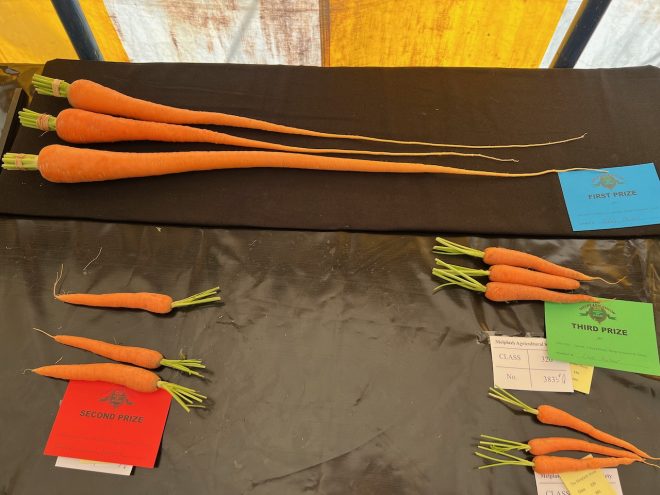
This screenshot has width=660, height=495. Find the location of `table`. table is located at coordinates 302,203.